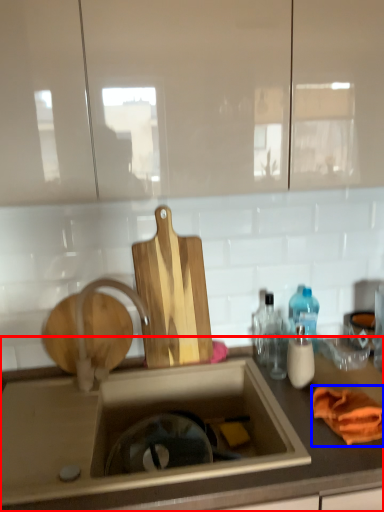
Question: Which of the following is the closest to the observer, countertop (highlighted by a red box) or material (highlighted by a blue box)?

Choices:
 (A) countertop
 (B) material

Answer: (A)